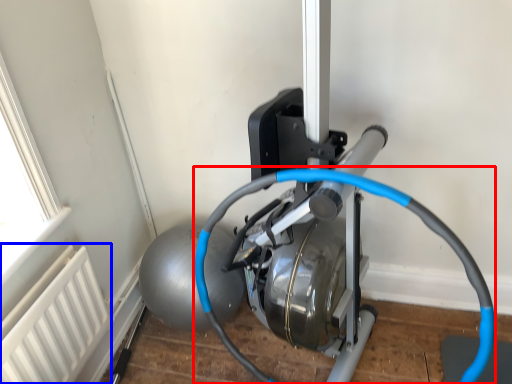
Question: Which object appears closest to the camera in this image, wire (highlighted by a red box) or radiator (highlighted by a blue box)?

Choices:
 (A) wire
 (B) radiator

Answer: (A)